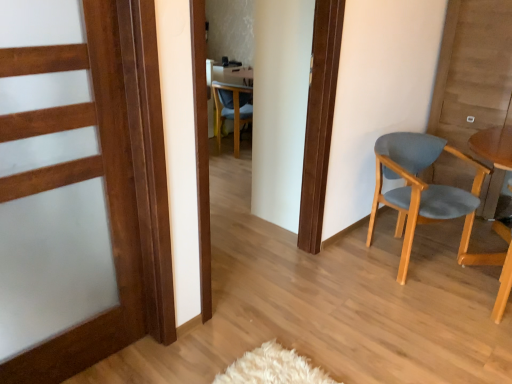
Question: From a real-world perspective, is wooden door at left above or below light blue fabric chair at right, the 1th chair positioned from the bottom?

Choices:
 (A) above
 (B) below

Answer: (A)

Question: Do you think wooden door at left is within light blue fabric chair at right, placed as the second chair when sorted from left to right, or outside of it?

Choices:
 (A) outside
 (B) inside

Answer: (A)

Question: Which of these objects is positioned farthest from the wooden door at left?

Choices:
 (A) light blue fabric chair at right, placed as the second chair when sorted from left to right
 (B) blue fabric chair at center, which is counted as the second chair, starting from the front

Answer: (B)

Question: Which is nearer to the light blue fabric chair at right, the second chair when ordered from top to bottom?

Choices:
 (A) wooden door at left
 (B) blue fabric chair at center, placed as the second chair when sorted from right to left

Answer: (A)